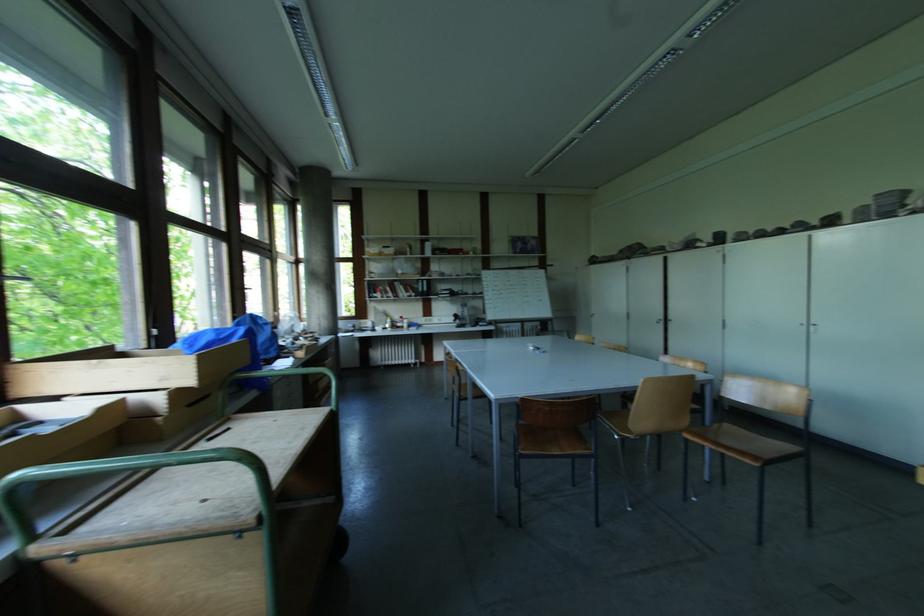
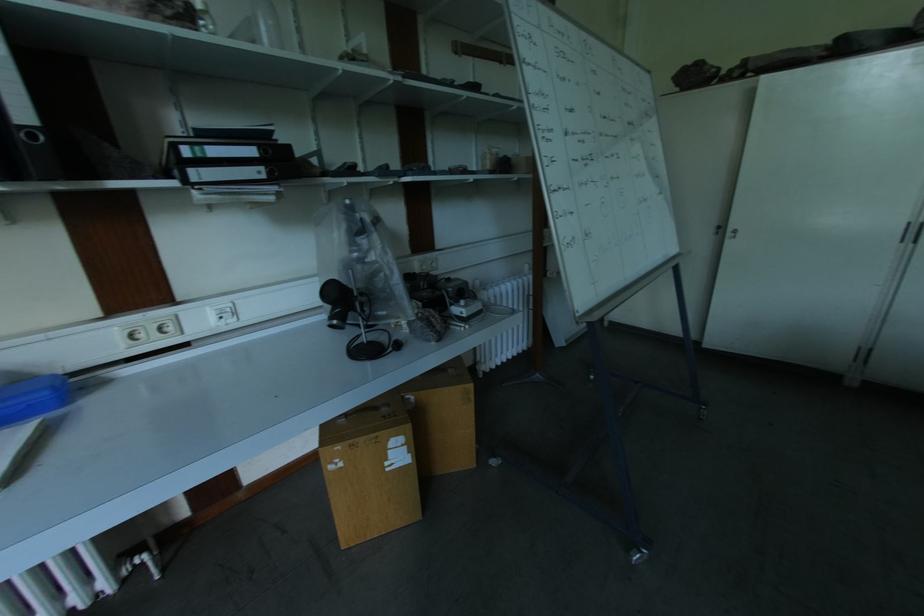
Where in the second image is the point corresponding to (x=594, y=318) from the first image?

(737, 238)